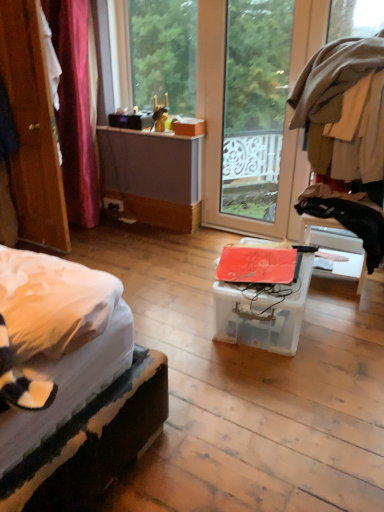
Question: Can you confirm if wooden door at left is smaller than transparent plastic box at center?

Choices:
 (A) yes
 (B) no

Answer: (B)

Question: Does wooden door at left have a lesser width compared to transparent plastic box at center?

Choices:
 (A) no
 (B) yes

Answer: (B)

Question: Considering the relative sizes of wooden door at left and transparent plastic box at center in the image provided, is wooden door at left shorter than transparent plastic box at center?

Choices:
 (A) no
 (B) yes

Answer: (A)

Question: Is wooden door at left positioned with its back to transparent plastic box at center?

Choices:
 (A) yes
 (B) no

Answer: (B)

Question: Is wooden door at left aimed at transparent plastic box at center?

Choices:
 (A) yes
 (B) no

Answer: (A)

Question: From a real-world perspective, is transparent plastic box at center above or below black fabric at right?

Choices:
 (A) below
 (B) above

Answer: (A)

Question: Is transparent plastic box at center in front of or behind black fabric at right in the image?

Choices:
 (A) behind
 (B) front

Answer: (B)

Question: Considering the positions of transparent plastic box at center and black fabric at right in the image, is transparent plastic box at center bigger or smaller than black fabric at right?

Choices:
 (A) small
 (B) big

Answer: (B)

Question: Visually, is transparent plastic box at center positioned to the left or to the right of black fabric at right?

Choices:
 (A) left
 (B) right

Answer: (A)

Question: Considering the positions of transparent glass door at center and transparent glass window at upper center in the image, is transparent glass door at center wider or thinner than transparent glass window at upper center?

Choices:
 (A) wide
 (B) thin

Answer: (B)

Question: From a real-world perspective, relative to transparent glass window at upper center, is transparent glass door at center vertically above or below?

Choices:
 (A) below
 (B) above

Answer: (A)

Question: Would you say transparent glass door at center is inside or outside transparent glass window at upper center?

Choices:
 (A) outside
 (B) inside

Answer: (A)

Question: From the image's perspective, is transparent glass door at center located above or below transparent glass window at upper center?

Choices:
 (A) above
 (B) below

Answer: (B)

Question: Is wooden door at left inside or outside of transparent plastic box at center?

Choices:
 (A) outside
 (B) inside

Answer: (A)

Question: From the image's perspective, is wooden door at left located above or below transparent plastic box at center?

Choices:
 (A) below
 (B) above

Answer: (B)